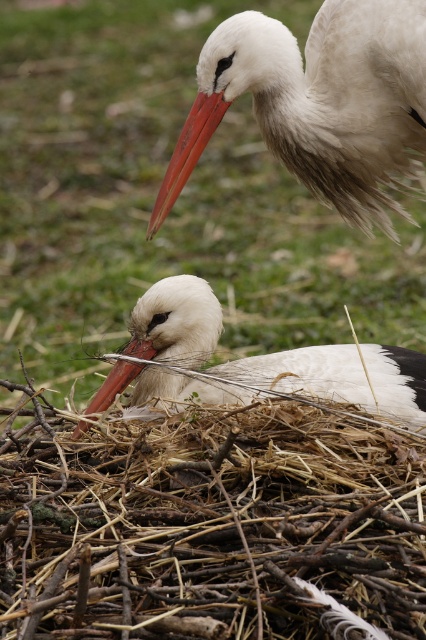
Question: Does green grass at center have a smaller size compared to matte red beak at upper center?

Choices:
 (A) yes
 (B) no

Answer: (B)

Question: Is white matte bird at center bigger than matte orange beak at center?

Choices:
 (A) yes
 (B) no

Answer: (A)

Question: Is green grass at center further to the viewer compared to white matte bird at center?

Choices:
 (A) yes
 (B) no

Answer: (A)

Question: Estimate the real-world distances between objects in this image. Which object is closer to the green grass at center?

Choices:
 (A) matte red beak at upper center
 (B) white matte stork at upper center
 (C) white matte bird at center
 (D) brown straw nest at lower center

Answer: (C)

Question: Considering the real-world distances, which object is farthest from the brown straw nest at lower center?

Choices:
 (A) white matte bird at center
 (B) white matte stork at upper center
 (C) green grass at center

Answer: (C)

Question: Which is nearer to the matte orange beak at center?

Choices:
 (A) white matte stork at upper center
 (B) brown straw nest at lower center

Answer: (B)